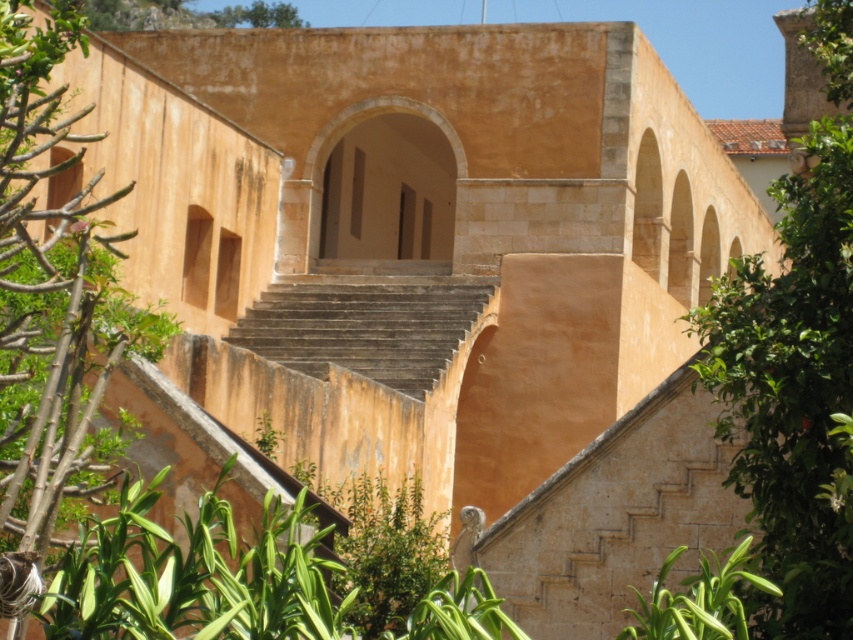
Question: Which point is farther from the camera taking this photo?

Choices:
 (A) pyautogui.click(x=811, y=410)
 (B) pyautogui.click(x=274, y=8)

Answer: (B)

Question: Among these objects, which one is nearest to the camera?

Choices:
 (A) green leafy tree at upper center
 (B) green leafy plant at lower right
 (C) beige stone archway at center

Answer: (B)

Question: Is beige stone archway at center bigger than brown stone stairs at center?

Choices:
 (A) no
 (B) yes

Answer: (B)

Question: In this image, where is green leafy tree at right located relative to green leafy tree at left?

Choices:
 (A) right
 (B) left

Answer: (A)

Question: Which point appears farthest from the camera in this image?

Choices:
 (A) (801, 349)
 (B) (231, 17)

Answer: (B)

Question: Can you confirm if beige stone archway at center is positioned above brown stone stairs at center?

Choices:
 (A) yes
 (B) no

Answer: (A)